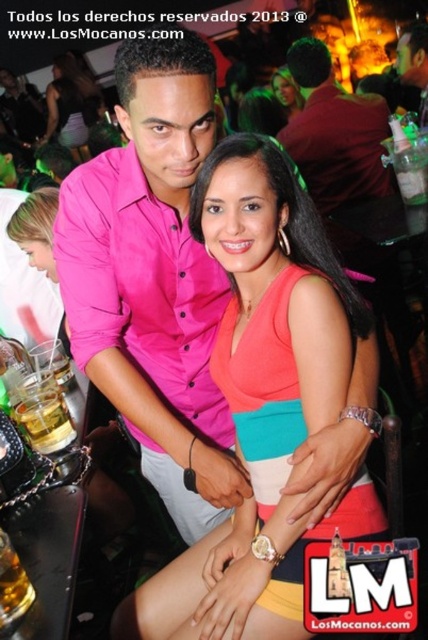
Question: Observing the image, what is the correct spatial positioning of matte black dress at center in reference to matte coral dress at center?

Choices:
 (A) above
 (B) below

Answer: (A)

Question: Which object is farther from the camera taking this photo?

Choices:
 (A) dark red shirt at upper center
 (B) translucent glass at lower left
 (C) pink matte shirt at center

Answer: (A)

Question: Which object is farther from the camera taking this photo?

Choices:
 (A) translucent glass at lower left
 (B) matte black dress at center
 (C) pink matte shirt at center

Answer: (B)

Question: Is dark red shirt at upper center above matte black dress at center?

Choices:
 (A) yes
 (B) no

Answer: (B)

Question: Estimate the real-world distances between objects in this image. Which object is closer to the pink matte shirt at center?

Choices:
 (A) matte coral dress at center
 (B) matte black dress at center
 (C) translucent glass at lower left
 (D) pink fabric dress at center

Answer: (D)

Question: Does pink matte shirt at center come in front of matte coral dress at center?

Choices:
 (A) no
 (B) yes

Answer: (B)